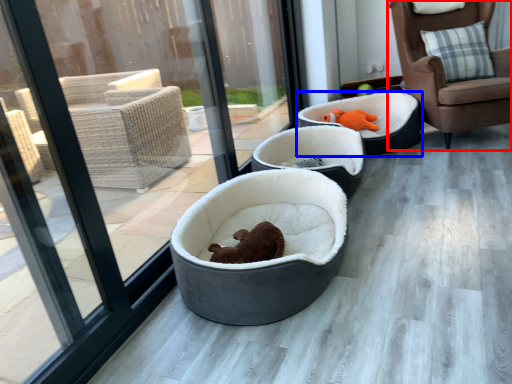
Question: Which object is further to the camera taking this photo, chair (highlighted by a red box) or dog bed (highlighted by a blue box)?

Choices:
 (A) chair
 (B) dog bed

Answer: (B)